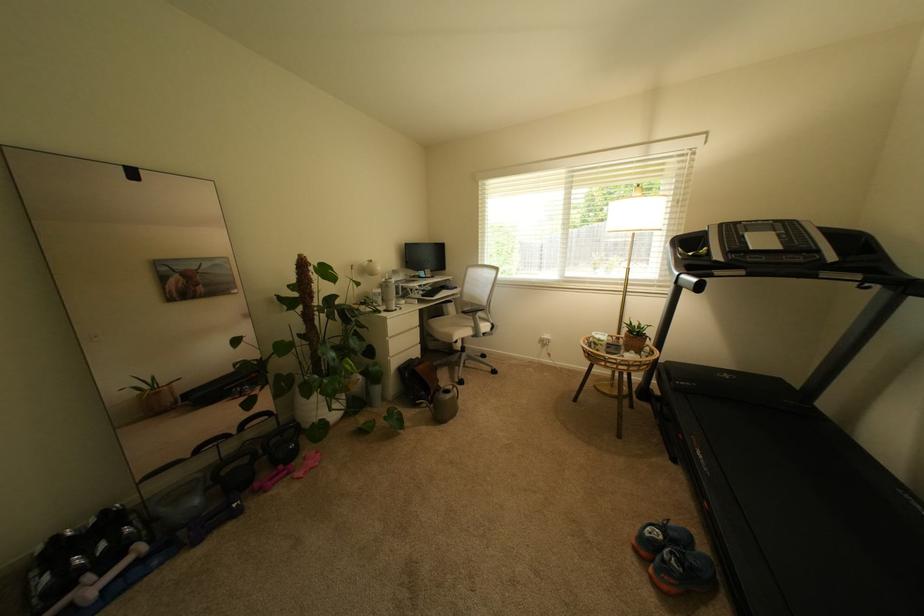
Which object does [321,406] point to?

It corresponds to the white plant pot in the image.